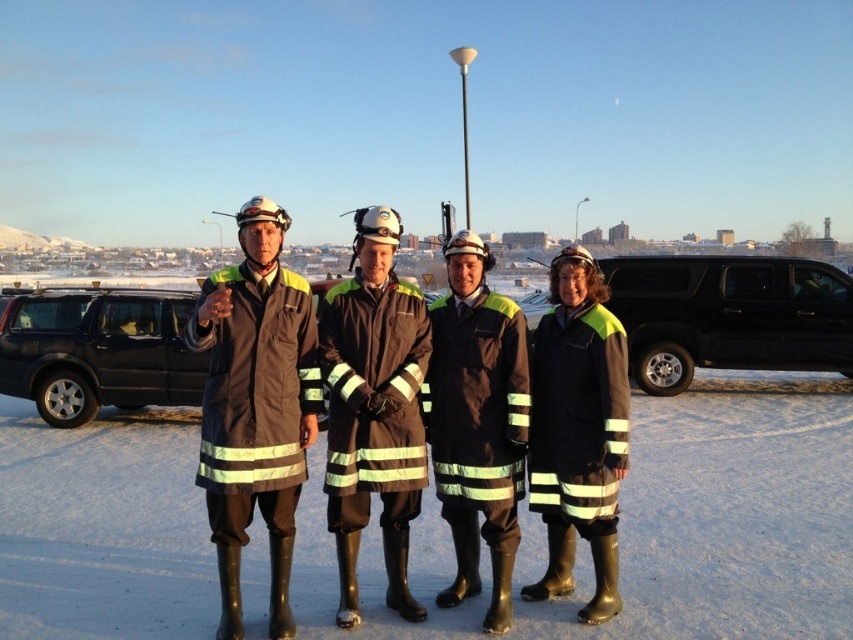
Question: Which point is farther to the camera?

Choices:
 (A) black matte suv at left
 (B) white matte snow at center
 (C) black fabric uniform at center
 (D) dark gray fabric coat at left

Answer: (A)

Question: Which object is closer to the camera taking this photo?

Choices:
 (A) white matte snow at center
 (B) black matte uniform at center

Answer: (A)

Question: Is black matte suv at left positioned behind reflective fabric jacket at center?

Choices:
 (A) no
 (B) yes

Answer: (B)

Question: Which point is closer to the camera?

Choices:
 (A) (460, 480)
 (B) (287, 301)
 (C) (410, 416)
 (D) (564, 388)

Answer: (B)

Question: Can you confirm if dark gray fabric coat at left is bigger than black matte uniform at center?

Choices:
 (A) yes
 (B) no

Answer: (A)

Question: Does dark gray fabric coat at left have a greater width compared to reflective fabric jacket at center?

Choices:
 (A) yes
 (B) no

Answer: (A)